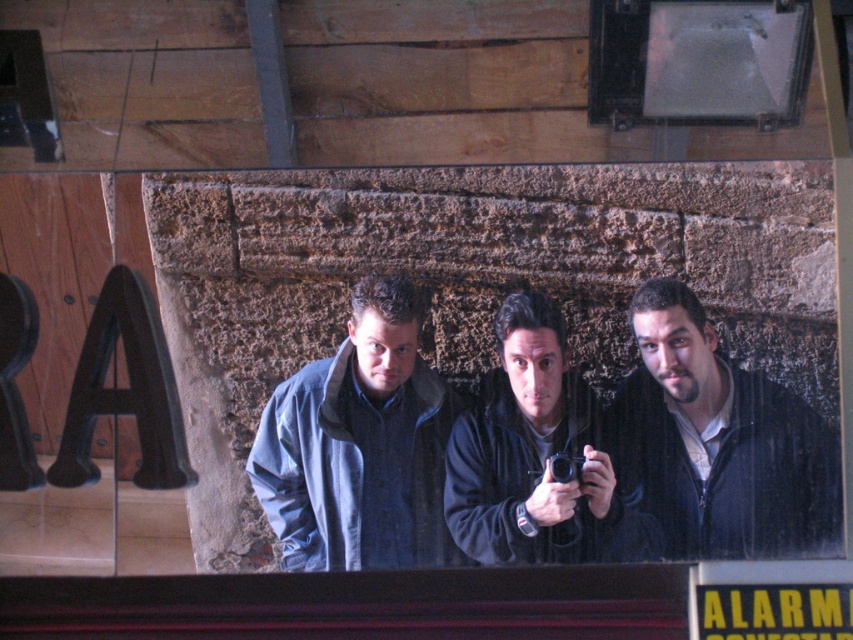
Question: Which point appears closest to the camera in this image?

Choices:
 (A) (526, 328)
 (B) (285, 497)
 (C) (839, 586)

Answer: (C)

Question: Which of the following is the farthest from the observer?

Choices:
 (A) yellow paper at upper center
 (B) denim jacket at center

Answer: (B)

Question: In this image, where is dark blue jacket at center located relative to yellow paper at upper center?

Choices:
 (A) left
 (B) right

Answer: (B)

Question: Is the position of dark blue fleece jacket at center more distant than that of yellow paper at upper center?

Choices:
 (A) no
 (B) yes

Answer: (B)

Question: Based on their relative distances, which object is nearer to the denim jacket at center?

Choices:
 (A) dark blue jacket at center
 (B) yellow paper at upper center
 (C) dark blue fleece jacket at center

Answer: (C)

Question: Can you confirm if dark blue fleece jacket at center is thinner than yellow paper at upper center?

Choices:
 (A) no
 (B) yes

Answer: (A)